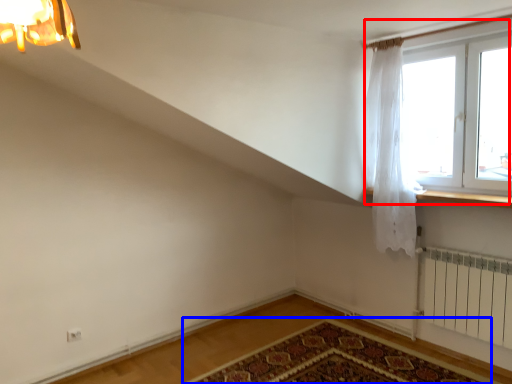
Question: Among these objects, which one is nearest to the camera, window (highlighted by a red box) or mat (highlighted by a blue box)?

Choices:
 (A) window
 (B) mat

Answer: (B)